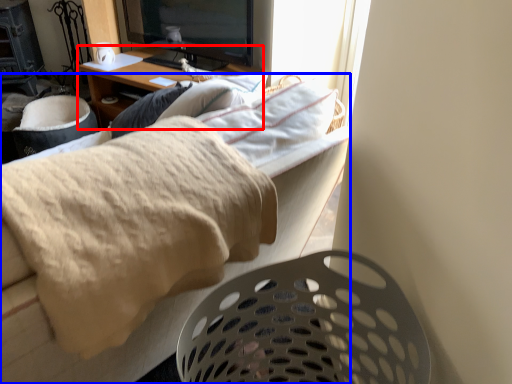
Question: Which point is further to the camera, desk (highlighted by a red box) or furniture (highlighted by a blue box)?

Choices:
 (A) desk
 (B) furniture

Answer: (A)